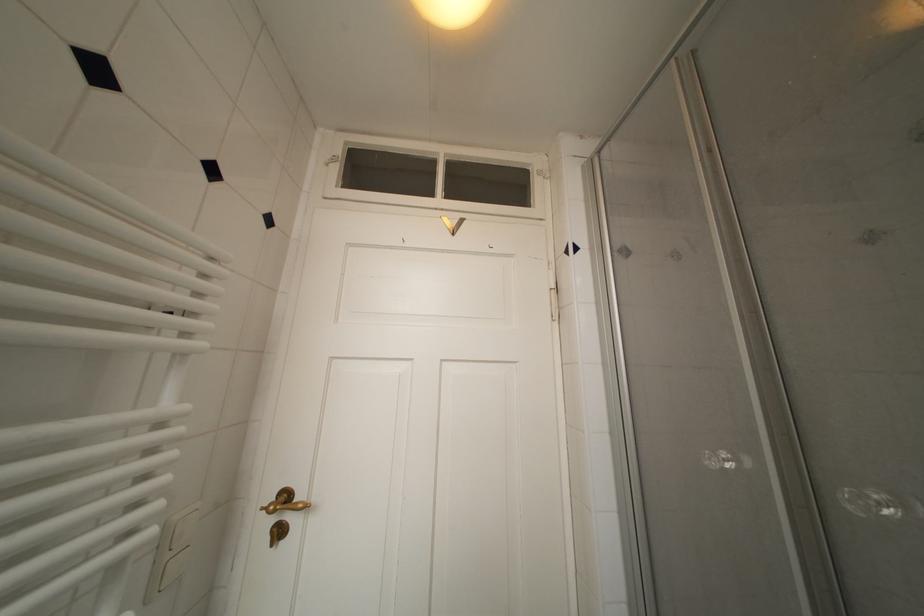
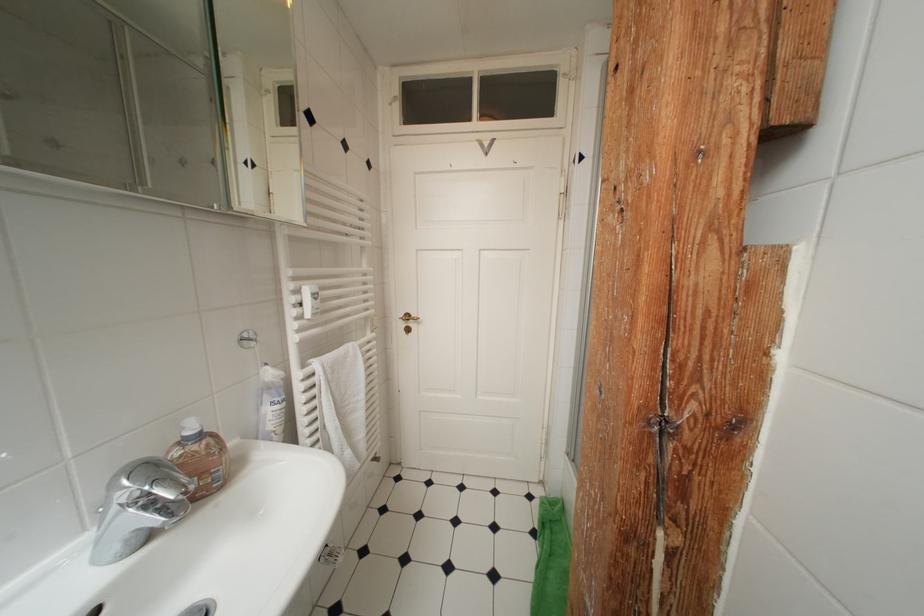
Find the pixel in the second image that matches (x=293, y=500) in the first image.

(415, 320)